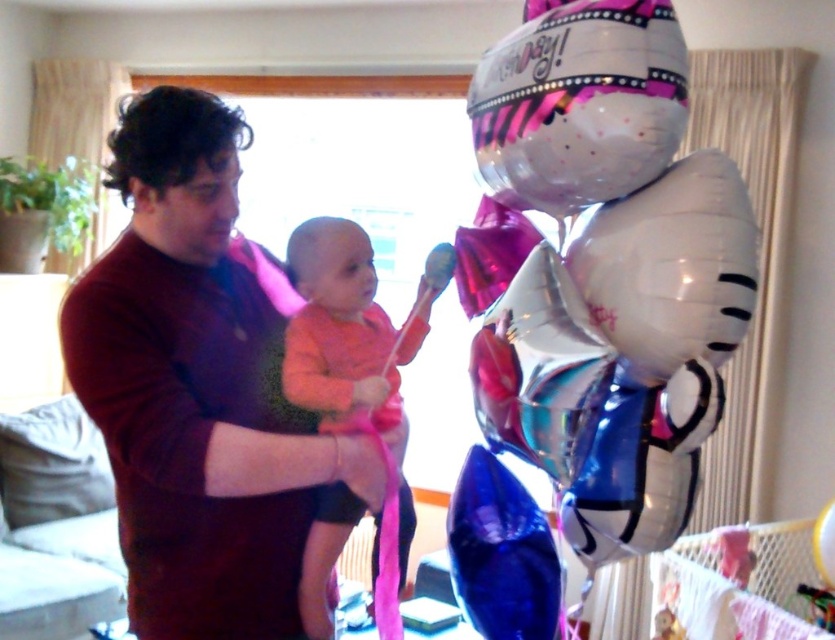
Question: Which object is positioned farthest from the blue metallic balloon at right?

Choices:
 (A) orange soft fabric baby at center
 (B) metallic silver balloons at right
 (C) matte dark red shirt at center

Answer: (C)

Question: Which object is positioned closest to the blue metallic balloon at right?

Choices:
 (A) orange soft fabric baby at center
 (B) matte dark red shirt at center

Answer: (A)

Question: Is the position of matte dark red shirt at center less distant than that of orange soft fabric baby at center?

Choices:
 (A) no
 (B) yes

Answer: (B)

Question: Which is farther from the matte dark red shirt at center?

Choices:
 (A) blue metallic balloon at right
 (B) orange soft fabric baby at center

Answer: (A)

Question: From the image, what is the correct spatial relationship of matte dark red shirt at center in relation to blue metallic balloon at right?

Choices:
 (A) left
 (B) right

Answer: (A)

Question: Considering the relative positions of metallic silver balloons at right and blue metallic balloon at right in the image provided, where is metallic silver balloons at right located with respect to blue metallic balloon at right?

Choices:
 (A) left
 (B) right

Answer: (B)